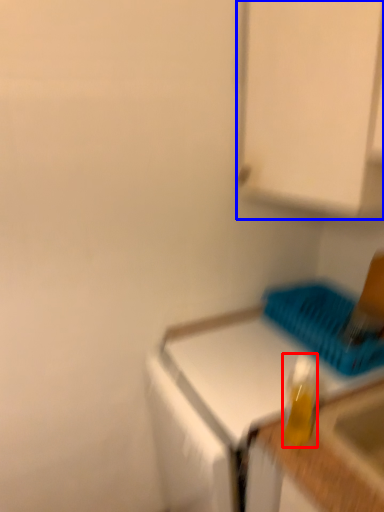
Question: Among these objects, which one is nearest to the camera, bottle (highlighted by a red box) or cabinetry (highlighted by a blue box)?

Choices:
 (A) bottle
 (B) cabinetry

Answer: (B)